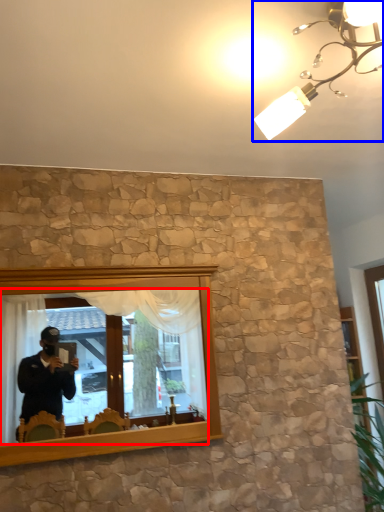
Question: Which of the following is the farthest to the observer, mirror (highlighted by a red box) or light fixture (highlighted by a blue box)?

Choices:
 (A) mirror
 (B) light fixture

Answer: (A)